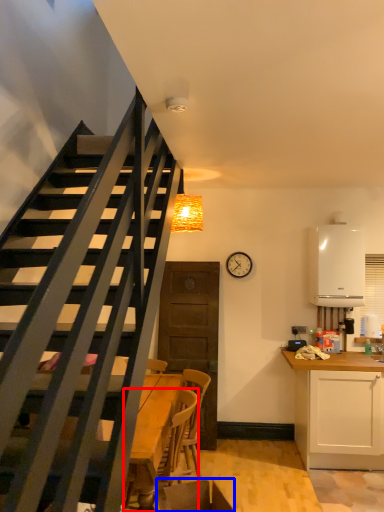
Question: Which object is further to the camera taking this photo, chair (highlighted by a red box) or swivel chair (highlighted by a blue box)?

Choices:
 (A) chair
 (B) swivel chair

Answer: (A)